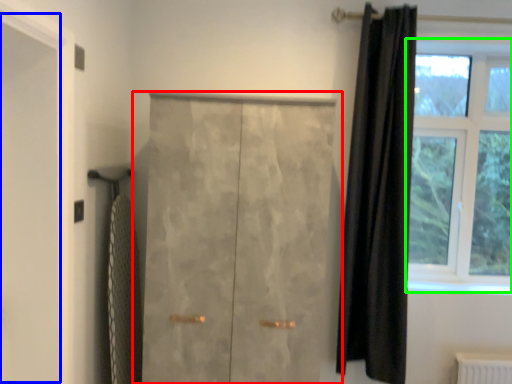
Question: Which object is positioned closest to door (highlighted by a red box)? Select from screen door (highlighted by a blue box) and window (highlighted by a green box).

Choices:
 (A) screen door
 (B) window

Answer: (A)